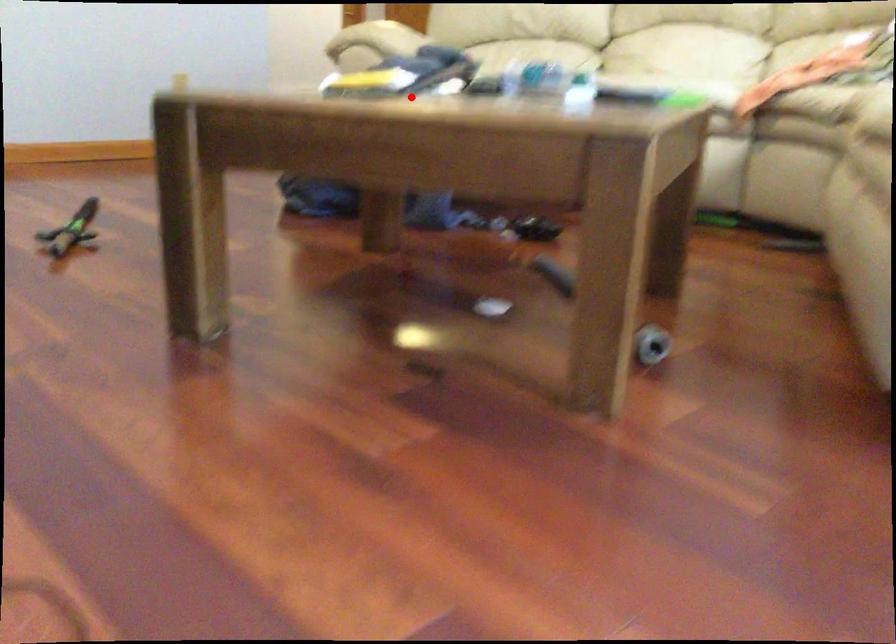
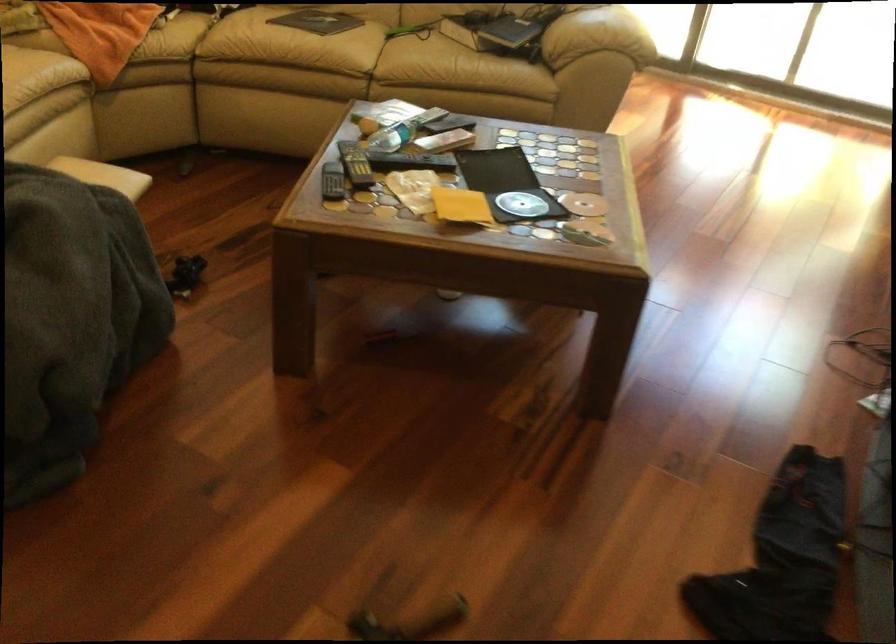
Question: I am providing you with two images of the same scene from different viewpoints. A red point is shown in image1. For the corresponding object point in image2, is it positioned nearer or farther from the camera?

Choices:
 (A) Nearer
 (B) Farther

Answer: (B)